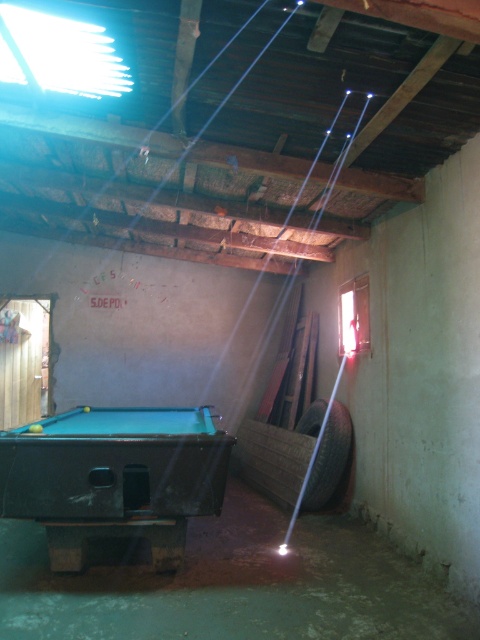
Question: Is green felt pool table at center thinner than black rubber tire at lower right?

Choices:
 (A) no
 (B) yes

Answer: (A)

Question: Which of the following is the farthest from the observer?

Choices:
 (A) black rubber tire at lower right
 (B) green felt pool table at center

Answer: (A)

Question: Which point appears closest to the camera in this image?

Choices:
 (A) (348, 412)
 (B) (98, 445)

Answer: (B)

Question: Can you confirm if green felt pool table at center is positioned above black rubber tire at lower right?

Choices:
 (A) no
 (B) yes

Answer: (B)

Question: Is the position of green felt pool table at center more distant than that of black rubber tire at lower right?

Choices:
 (A) no
 (B) yes

Answer: (A)